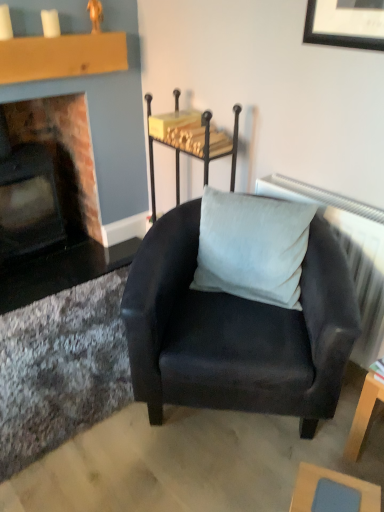
Question: Should I look upward or downward to see suede black armchair at center?

Choices:
 (A) up
 (B) down

Answer: (B)

Question: From a real-world perspective, does light blue fabric table at lower right, the 3th table when ordered from back to front, sit lower than suede-like gray pillow at center?

Choices:
 (A) no
 (B) yes

Answer: (B)

Question: Would you say light blue fabric table at lower right, placed as the 3th table when sorted from top to bottom, is outside suede-like gray pillow at center?

Choices:
 (A) no
 (B) yes

Answer: (B)

Question: Does light blue fabric table at lower right, the second table viewed from the right, contain suede-like gray pillow at center?

Choices:
 (A) no
 (B) yes

Answer: (A)

Question: Considering the relative sizes of light blue fabric table at lower right, the 1th table in the front-to-back sequence, and suede-like gray pillow at center in the image provided, is light blue fabric table at lower right, the 1th table in the front-to-back sequence, smaller than suede-like gray pillow at center?

Choices:
 (A) no
 (B) yes

Answer: (B)

Question: Is light blue fabric table at lower right, which appears as the 1th table when ordered from the bottom, next to suede-like gray pillow at center and touching it?

Choices:
 (A) no
 (B) yes

Answer: (A)

Question: Does light blue fabric table at lower right, placed as the 3th table when sorted from top to bottom, have a greater width compared to suede-like gray pillow at center?

Choices:
 (A) no
 (B) yes

Answer: (A)

Question: Is matte brick fireplace at left located within wooden table at lower right, which is counted as the 2th table, starting from the front?

Choices:
 (A) yes
 (B) no

Answer: (B)

Question: Considering the relative sizes of wooden table at lower right, the 2th table from the back, and matte brick fireplace at left in the image provided, is wooden table at lower right, the 2th table from the back, thinner than matte brick fireplace at left?

Choices:
 (A) no
 (B) yes

Answer: (B)

Question: Considering the relative sizes of wooden table at lower right, which ranks as the first table in right-to-left order, and matte brick fireplace at left in the image provided, is wooden table at lower right, which ranks as the first table in right-to-left order, wider than matte brick fireplace at left?

Choices:
 (A) no
 (B) yes

Answer: (A)

Question: Considering the relative positions of wooden table at lower right, which is counted as the 2th table, starting from the front, and matte brick fireplace at left in the image provided, is wooden table at lower right, which is counted as the 2th table, starting from the front, to the left of matte brick fireplace at left from the viewer's perspective?

Choices:
 (A) no
 (B) yes

Answer: (A)

Question: From the image's perspective, is wooden table at lower right, which ranks as the first table in right-to-left order, under matte brick fireplace at left?

Choices:
 (A) yes
 (B) no

Answer: (A)

Question: Does wooden table at lower right, the 2th table from the back, have a smaller size compared to matte brick fireplace at left?

Choices:
 (A) no
 (B) yes

Answer: (B)

Question: From the image's perspective, does suede black armchair at center appear lower than wooden table at lower right, which appears as the second table when ordered from the bottom?

Choices:
 (A) no
 (B) yes

Answer: (A)